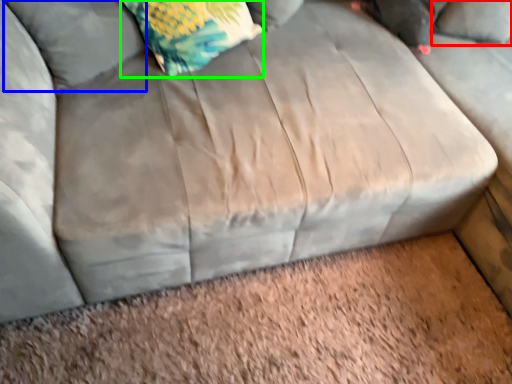
Question: Which is farther away from pillow (highlighted by a red box)? pillow (highlighted by a blue box) or throw pillow (highlighted by a green box)?

Choices:
 (A) pillow
 (B) throw pillow

Answer: (A)